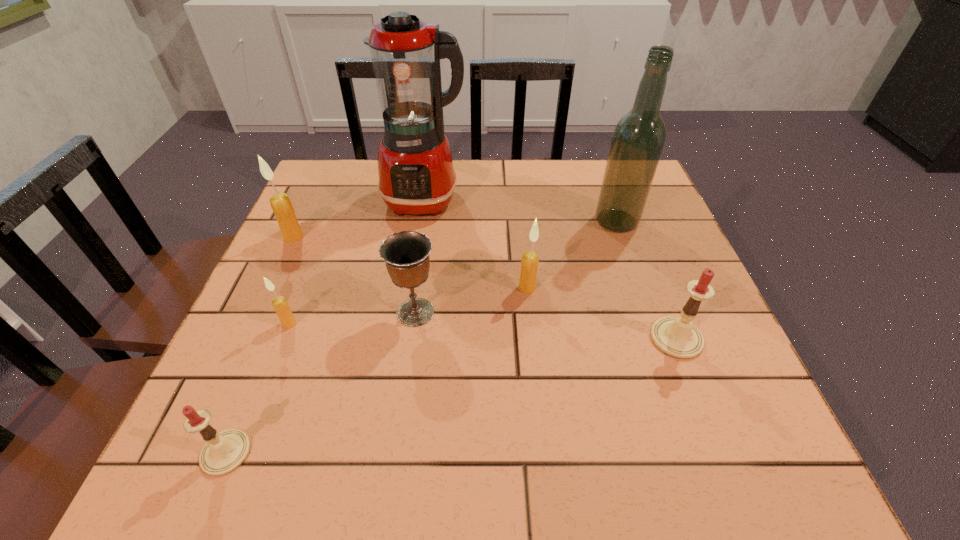
The image size is (960, 540). I want to click on free space between the second candle from right to left and the food processor, so click(476, 244).

Locate an element on the screen. blank region between the liquor and the second cream candle from right to left is located at coordinates (453, 273).

Choose which object is the third nearest neighbor to the second farthest candle. Please provide its 2D coordinates. Your answer should be formatted as a tuple, i.e. [(x, y)], where the tuple contains the x and y coordinates of a point satisfying the conditions above.

[(638, 139)]

I want to click on object identified as the third closest to the bronze chalice, so click(416, 176).

Where is `the second closest candle to the food processor`? The height and width of the screenshot is (540, 960). the second closest candle to the food processor is located at coordinates (529, 263).

Identify which candle is located as the third nearest to the green liquor. Please provide its 2D coordinates. Your answer should be formatted as a tuple, i.e. [(x, y)], where the tuple contains the x and y coordinates of a point satisfying the conditions above.

[(281, 306)]

Point out which cream candle is positioned as the second nearest to the farthest cream candle. Please provide its 2D coordinates. Your answer should be formatted as a tuple, i.e. [(x, y)], where the tuple contains the x and y coordinates of a point satisfying the conditions above.

[(529, 263)]

Find the location of `cream candle that is the third closest one to the right red candle`. cream candle that is the third closest one to the right red candle is located at coordinates (281, 205).

You are a GUI agent. You are given a task and a screenshot of the screen. Output one action in this format:
    pyautogui.click(x=<x>, y=<y>)
    Task: Click on the vacant space that satisfies the following two spatial constraints: 1. on the front side of the leftmost cream candle; 2. on the left side of the smallest cream candle
    This screenshot has height=540, width=960.
    Given the screenshot: What is the action you would take?
    pyautogui.click(x=253, y=323)

Locate an element on the screen. Image resolution: width=960 pixels, height=540 pixels. vacant space that satisfies the following two spatial constraints: 1. on the controls of the farther red candle; 2. on the left side of the food processor is located at coordinates (404, 339).